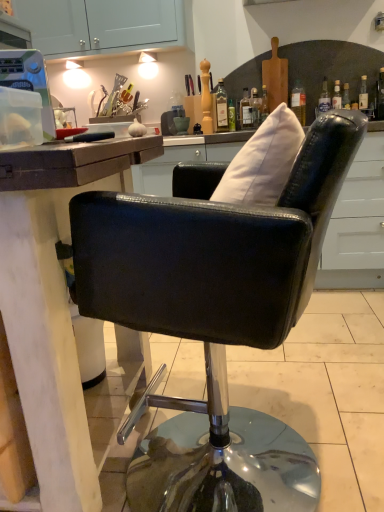
Question: In terms of height, does white fabric pillow at upper center look taller or shorter compared to transparent plastic container at upper left?

Choices:
 (A) tall
 (B) short

Answer: (A)

Question: Is point (264, 182) closer or farther from the camera than point (8, 57)?

Choices:
 (A) farther
 (B) closer

Answer: (B)

Question: Based on their relative distances, which object is nearer to the green glass bottle at upper center, the second bottle when ordered from right to left?

Choices:
 (A) white fabric pillow at upper center
 (B) transparent plastic container at upper left
 (C) transparent glass bottle at upper right, which is the 3th bottle in left-to-right order
 (D) translucent glass bottle at upper center, the 3th bottle from the right
 (E) black leather chair at center

Answer: (D)

Question: Estimate the real-world distances between objects in this image. Which object is closer to the transparent plastic container at upper left?

Choices:
 (A) white fabric pillow at upper center
 (B) transparent glass bottle at upper right, arranged as the 1th bottle when viewed from the right
 (C) green glass bottle at upper center, which ranks as the second bottle in left-to-right order
 (D) translucent glass bottle at upper center, the 3th bottle from the right
 (E) black leather chair at center

Answer: (A)